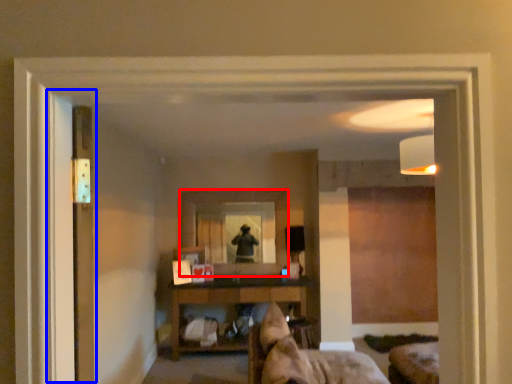
Question: Among these objects, which one is nearest to the camera, mirror (highlighted by a red box) or screen door (highlighted by a blue box)?

Choices:
 (A) mirror
 (B) screen door

Answer: (B)